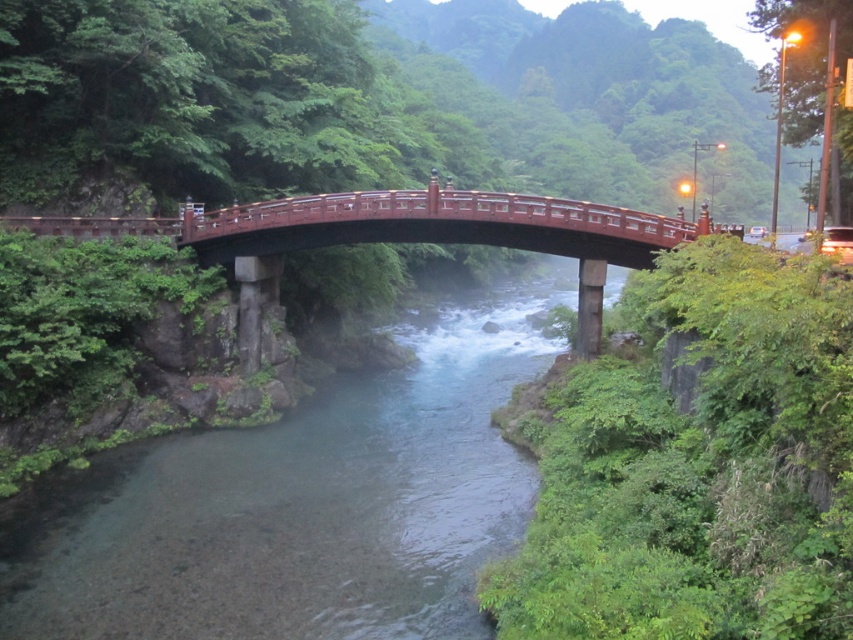
How much distance is there between clear water at center and shiny lacquered bridge at center?

clear water at center and shiny lacquered bridge at center are 8.85 meters apart.

Which of these two, clear water at center or shiny lacquered bridge at center, stands taller?

With more height is clear water at center.

Is point (248, 522) more distant than point (582, 269)?

No, (248, 522) is in front of (582, 269).

This screenshot has width=853, height=640. I want to click on clear water at center, so click(x=300, y=502).